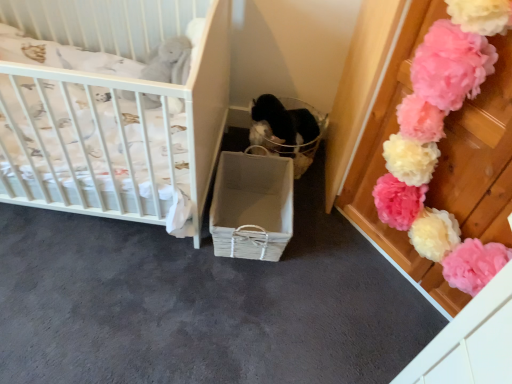
The height and width of the screenshot is (384, 512). In order to click on vacant space to the right of white wicker basket at center in this screenshot , I will do `click(324, 244)`.